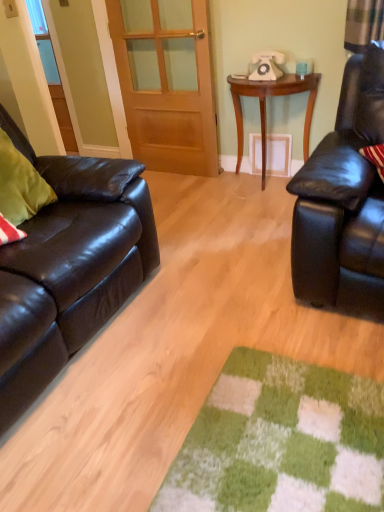
Locate an element on the screen. The width and height of the screenshot is (384, 512). vacant space underneath wooden table at center (from a real-world perspective) is located at coordinates (253, 183).